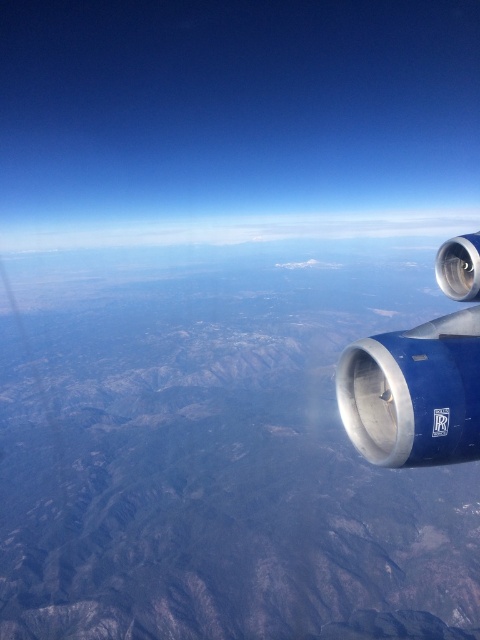
Question: Does blue metallic engine at right have a greater width compared to white fluffy cloud at upper center?

Choices:
 (A) yes
 (B) no

Answer: (B)

Question: Which point is closer to the camera?

Choices:
 (A) (184, 241)
 (B) (406, 371)

Answer: (B)

Question: Is blue metallic engine at right closer to camera compared to white fluffy cloud at upper center?

Choices:
 (A) yes
 (B) no

Answer: (A)

Question: Is the position of blue metallic engine at right more distant than that of white fluffy cloud at upper center?

Choices:
 (A) yes
 (B) no

Answer: (B)

Question: Which of the following is the closest to the observer?

Choices:
 (A) blue metallic engine at right
 (B) white fluffy cloud at upper center

Answer: (A)

Question: Which of the following is the closest to the observer?

Choices:
 (A) blue metallic engine at right
 (B) white fluffy cloud at upper center

Answer: (A)